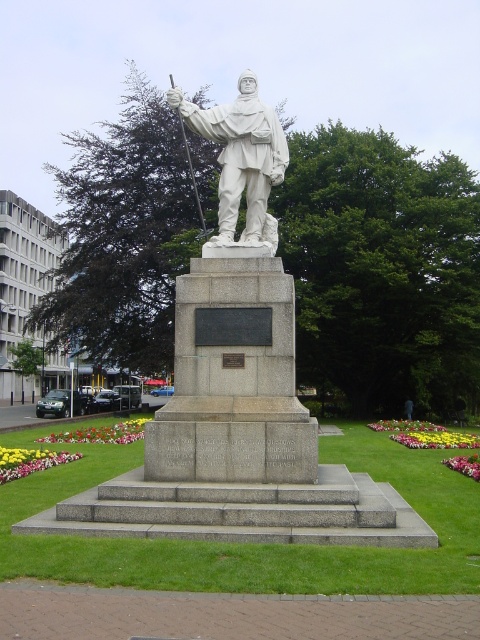
Question: Which point appears farthest from the camera in this image?

Choices:
 (A) (229, 243)
 (B) (191, 554)

Answer: (A)

Question: Among these points, which one is farthest from the camera?

Choices:
 (A) click(268, 237)
 (B) click(184, 588)

Answer: (A)

Question: Which point is farther to the camera?

Choices:
 (A) white marble statue at center
 (B) gray stone steps at center

Answer: (A)

Question: In this image, where is gray stone steps at center located relative to white marble statue at center?

Choices:
 (A) left
 (B) right

Answer: (B)

Question: Does gray stone steps at center have a smaller size compared to white marble statue at center?

Choices:
 (A) yes
 (B) no

Answer: (B)

Question: Can you confirm if gray stone steps at center is positioned above white marble statue at center?

Choices:
 (A) no
 (B) yes

Answer: (A)